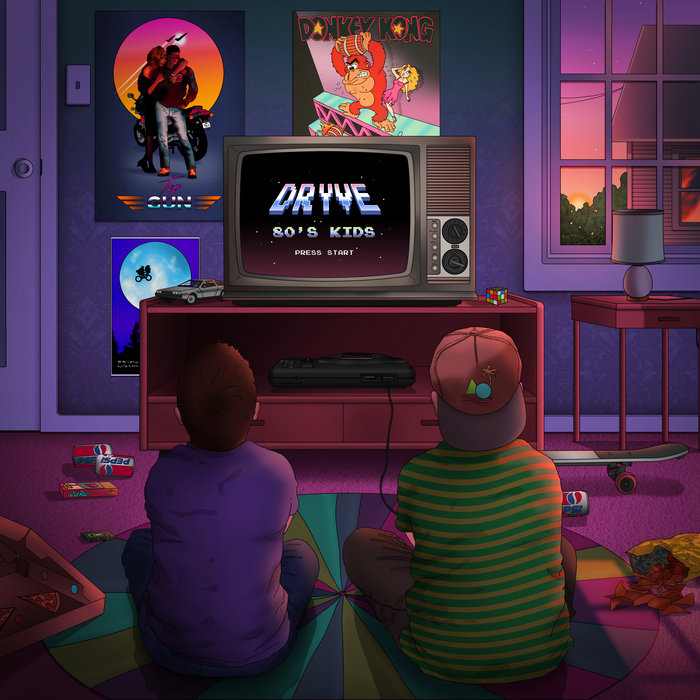
Identify the location of green wall. This screenshot has height=700, width=700. (491, 99).